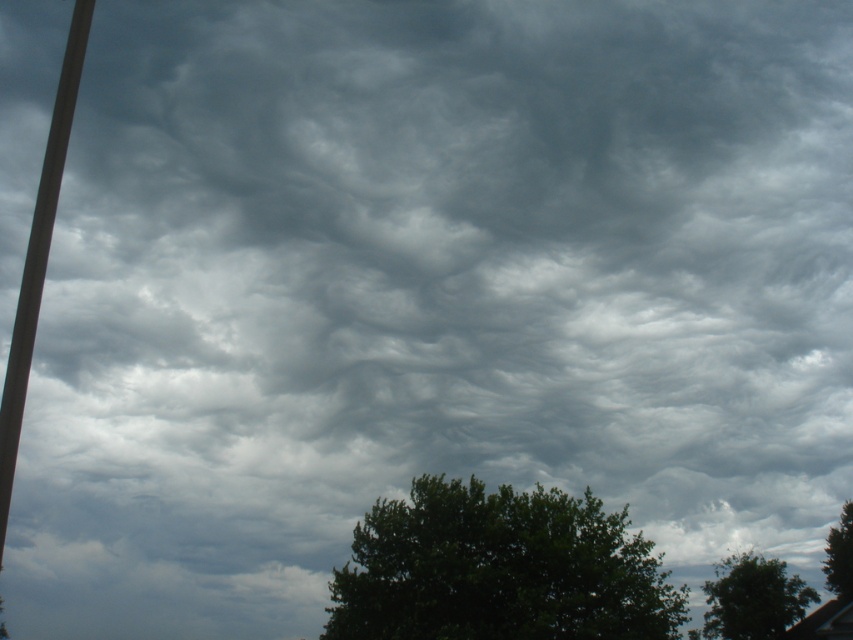
Is dark green leafy tree at center closer to the viewer compared to smooth gray pole at left?

No, it is not.

Does dark green leafy tree at center have a lesser height compared to smooth gray pole at left?

Yes.

This screenshot has width=853, height=640. Identify the location of dark green leafy tree at center. (498, 570).

Identify the location of dark green leafy tree at center. (498, 570).